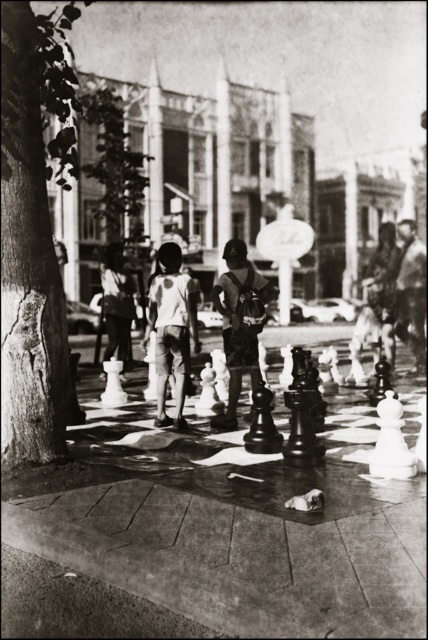
Question: Among these objects, which one is farthest from the camera?

Choices:
 (A) light gray cotton shorts at center
 (B) dark blue denim shorts at center

Answer: (A)

Question: Is light gray cotton shorts at center thinner than dark blue denim shorts at center?

Choices:
 (A) yes
 (B) no

Answer: (B)

Question: Does light gray cotton shorts at center have a lesser width compared to dark blue denim shorts at center?

Choices:
 (A) no
 (B) yes

Answer: (A)

Question: Can you confirm if light gray cotton shorts at center is bigger than dark blue denim shorts at center?

Choices:
 (A) yes
 (B) no

Answer: (A)

Question: Which object is closer to the camera taking this photo?

Choices:
 (A) dark blue denim shorts at center
 (B) light gray cotton shorts at center

Answer: (A)